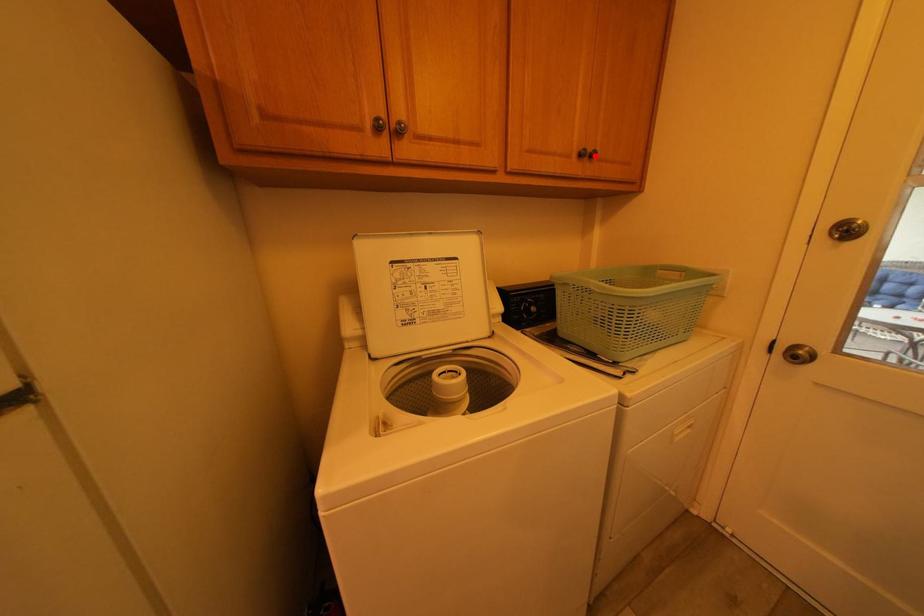
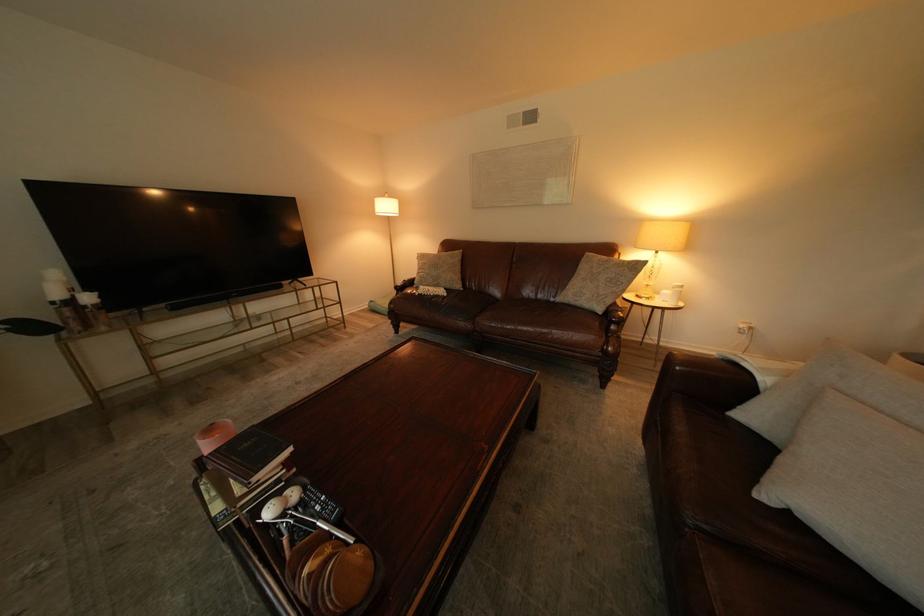
Question: I am providing you with two images of the same scene from different viewpoints. A red point is marked on the first image. Can you still see the location of the red point in image 2?

Choices:
 (A) Yes
 (B) No

Answer: (B)